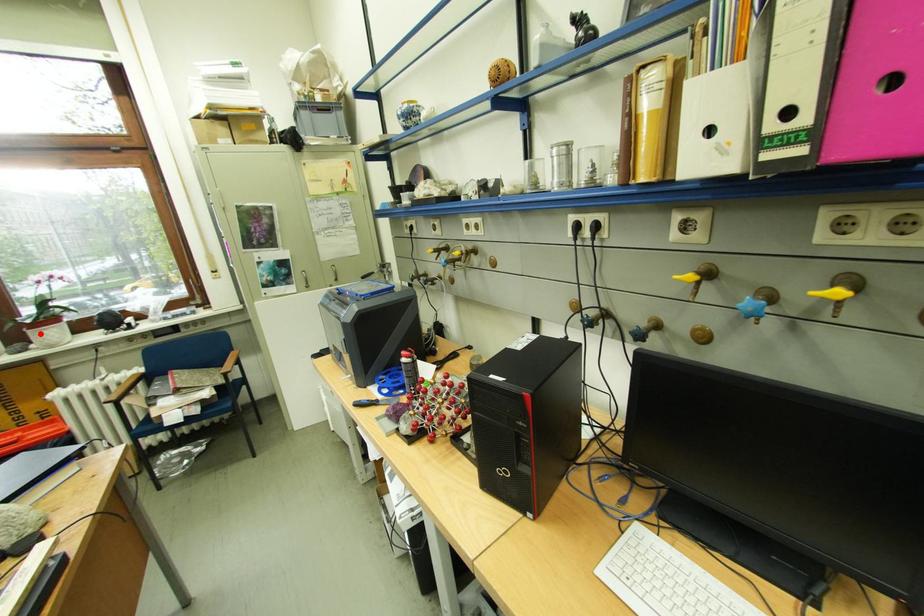
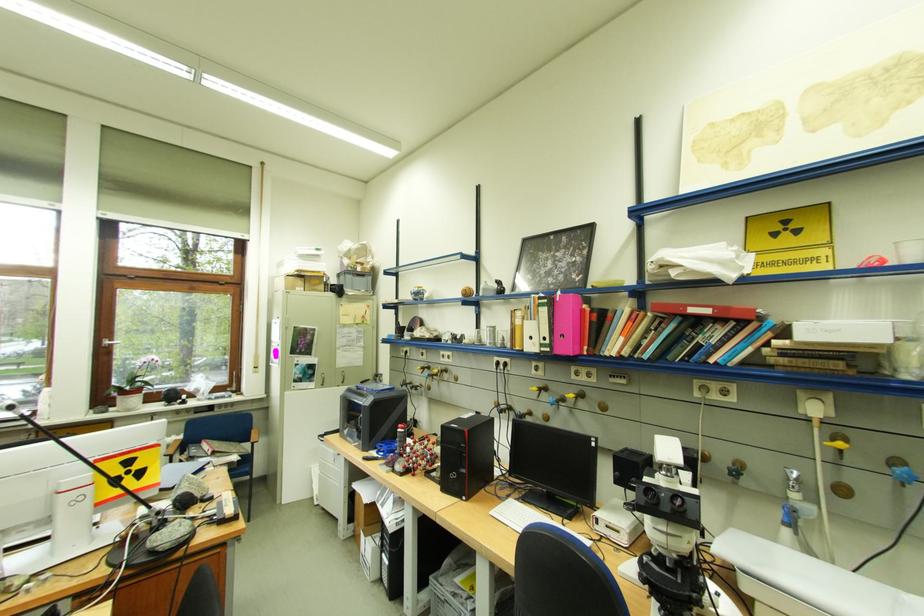
Locate, in the second image, the point that corresponds to the highlighted location in the first image.

(130, 399)